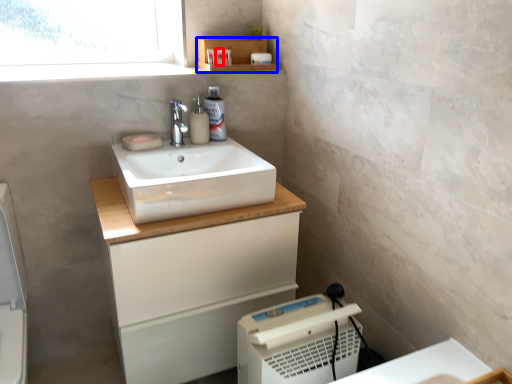
Question: Among these objects, which one is farthest to the camera, toiletry (highlighted by a red box) or shelf (highlighted by a blue box)?

Choices:
 (A) toiletry
 (B) shelf

Answer: (A)